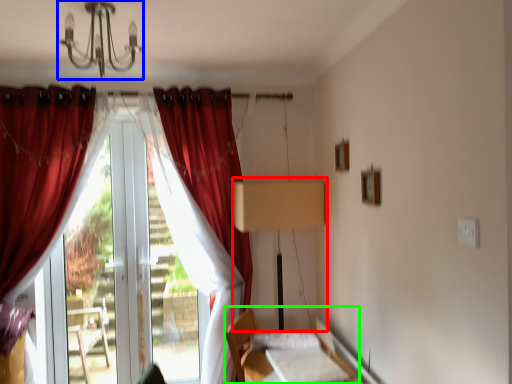
Question: Estimate the real-world distances between objects in this image. Which object is farther from table lamp (highlighted by a red box), light fixture (highlighted by a blue box) or bed (highlighted by a green box)?

Choices:
 (A) light fixture
 (B) bed

Answer: (A)